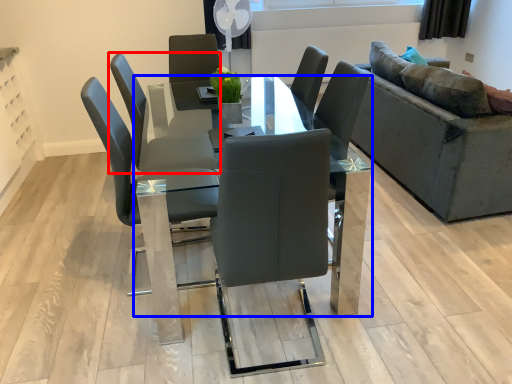
Question: Which of the following is the farthest to the observer, chair (highlighted by a red box) or table (highlighted by a blue box)?

Choices:
 (A) chair
 (B) table

Answer: (A)